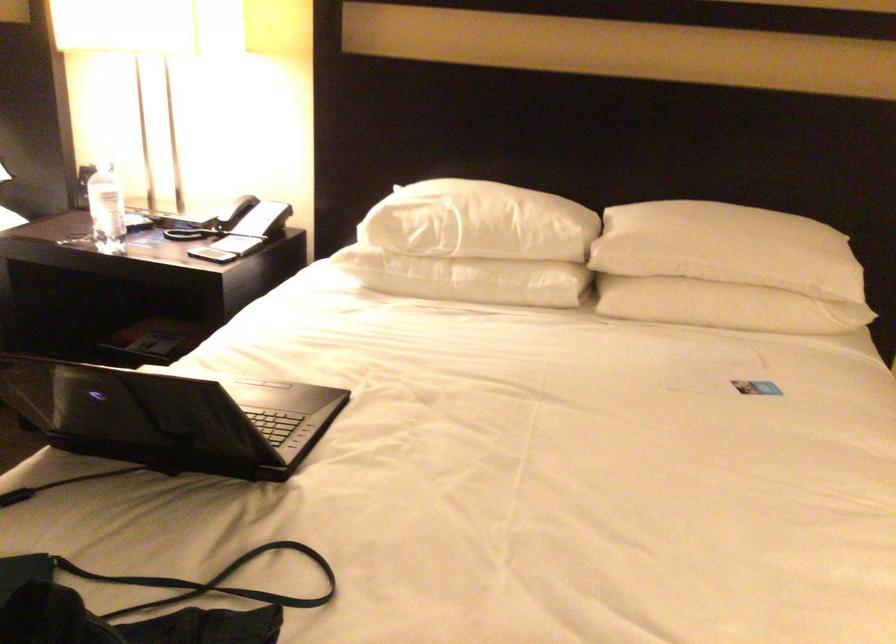
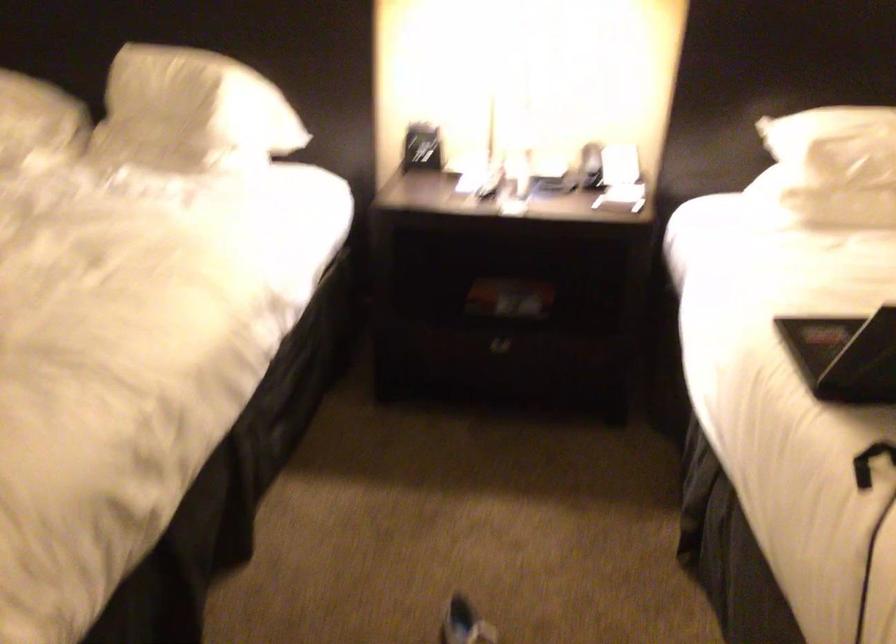
Find the pixel in the second image that matches (x=385, y=238) in the first image.

(831, 167)